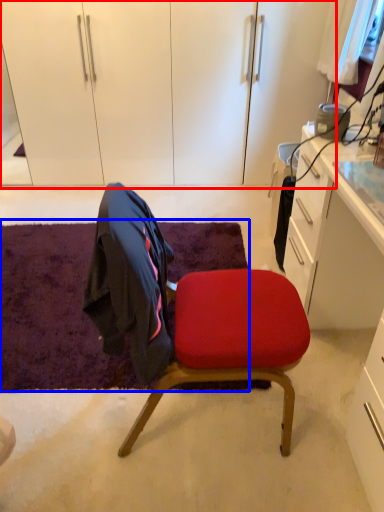
Question: Among these objects, which one is nearest to the camera, dresser (highlighted by a red box) or mat (highlighted by a blue box)?

Choices:
 (A) dresser
 (B) mat

Answer: (B)